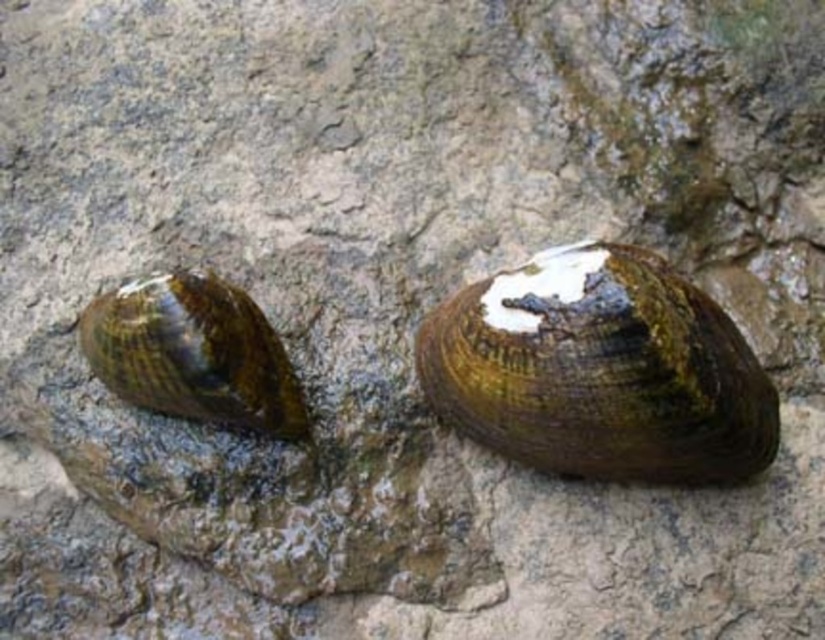
Does shiny brown shell at center have a smaller size compared to shiny brown shell at left?

No, shiny brown shell at center is not smaller than shiny brown shell at left.

Is shiny brown shell at center positioned in front of shiny brown shell at left?

Yes, it is in front of shiny brown shell at left.

At what (x,y) coordinates should I click in order to perform the action: click on shiny brown shell at center. Please return your answer as a coordinate pair (x, y). This screenshot has width=825, height=640. Looking at the image, I should click on (600, 371).

In order to click on shiny brown shell at center in this screenshot , I will do `click(600, 371)`.